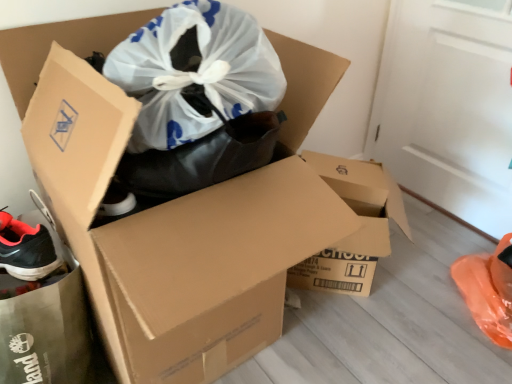
Question: Based on their sizes in the image, would you say black matte shoe at lower left is bigger or smaller than brown cardboard box at center, the second box in the left-to-right sequence?

Choices:
 (A) big
 (B) small

Answer: (B)

Question: From a real-world perspective, is black matte shoe at lower left physically located above or below brown cardboard box at center, the second box in the left-to-right sequence?

Choices:
 (A) above
 (B) below

Answer: (A)

Question: Which object is the closest to the brown cardboard box at center, positioned as the first box in left-to-right order?

Choices:
 (A) black matte shoe at lower left
 (B) brown cardboard box at center, the 1th box viewed from the right

Answer: (A)

Question: Considering the real-world distances, which object is closest to the brown cardboard box at center, the 1th box viewed from the right?

Choices:
 (A) brown cardboard box at center, positioned as the second box in right-to-left order
 (B) black matte shoe at lower left

Answer: (A)